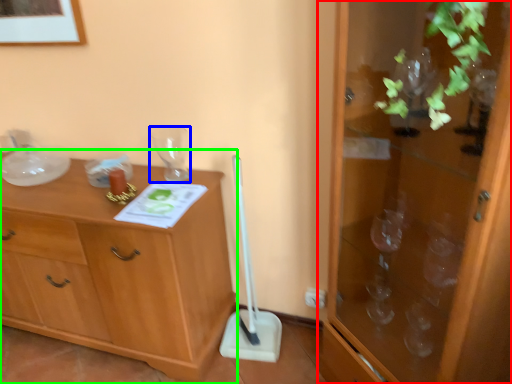
Question: Which object is positioned closest to cabinetry (highlighted by a red box)? Select from glass vase (highlighted by a blue box) and chest of drawers (highlighted by a green box).

Choices:
 (A) glass vase
 (B) chest of drawers

Answer: (B)